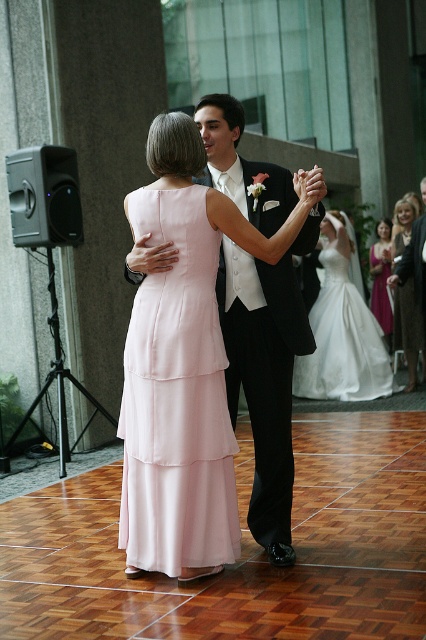
Question: Is white satin tuxedo at center positioned behind purple satin dress at right?

Choices:
 (A) yes
 (B) no

Answer: (B)

Question: Which object is closer to the camera taking this photo?

Choices:
 (A) white satin dress at center
 (B) purple satin dress at right
 (C) white satin tuxedo at center
 (D) light pink satin dress at center

Answer: (C)

Question: Does white satin dress at center have a lesser width compared to purple satin dress at right?

Choices:
 (A) no
 (B) yes

Answer: (A)

Question: Which point is closer to the camera?

Choices:
 (A) (373, 310)
 (B) (342, 243)
 (C) (195, 179)
 (D) (183, 470)

Answer: (D)

Question: Can you confirm if white satin tuxedo at center is bigger than white satin dress at center?

Choices:
 (A) yes
 (B) no

Answer: (B)

Question: Estimate the real-world distances between objects in this image. Which object is closer to the light pink satin dress at center?

Choices:
 (A) purple satin dress at right
 (B) white satin dress at center
 (C) white satin tuxedo at center

Answer: (C)